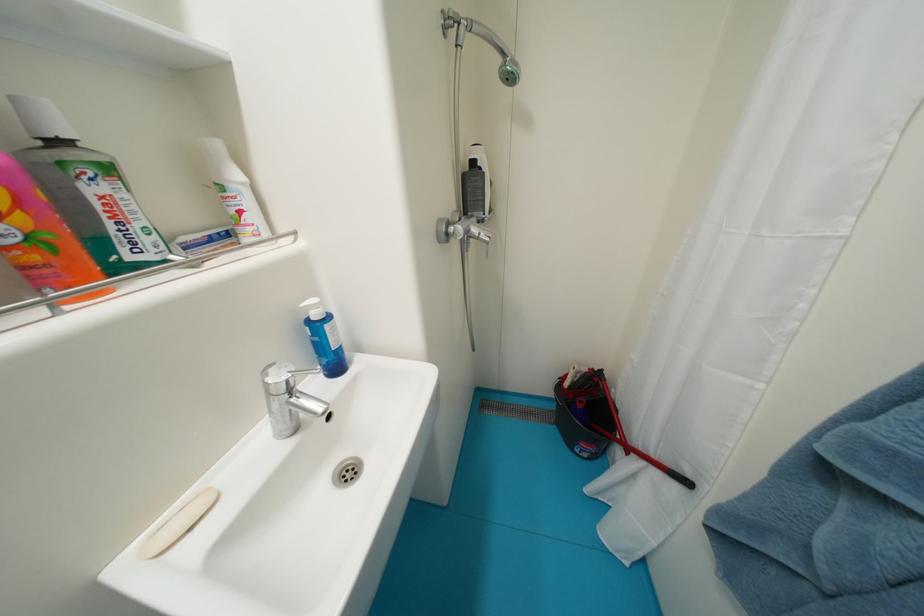
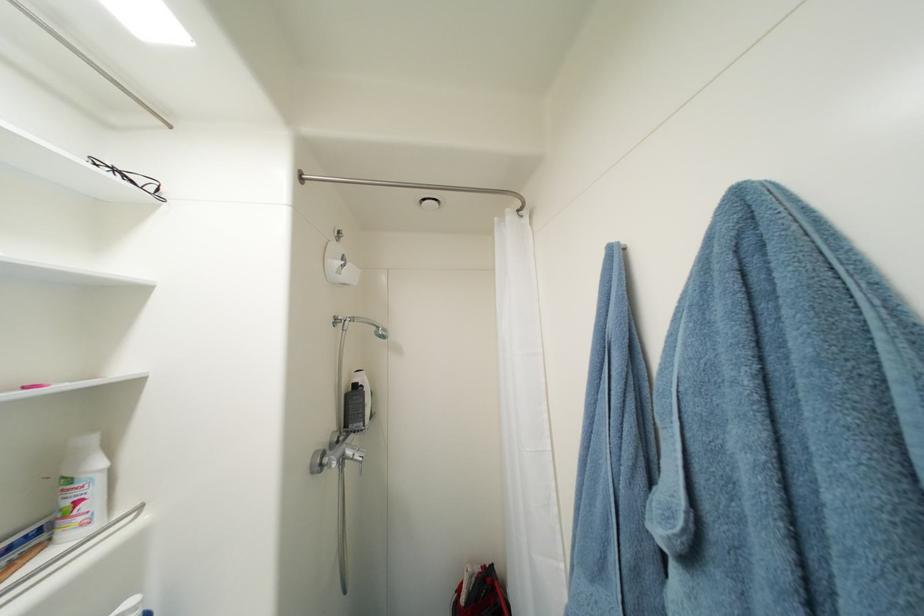
Find the pixel in the second image that matches (x=481, y=231) in the first image.

(356, 454)